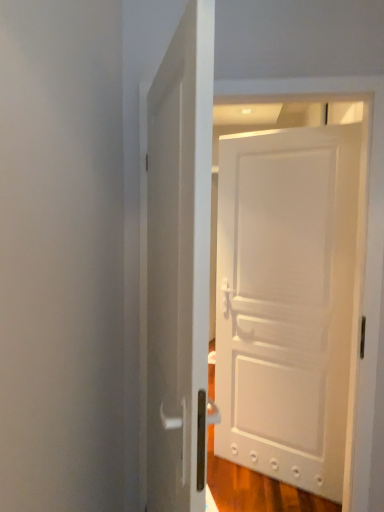
This screenshot has width=384, height=512. In order to click on vacant region under white matte door at center, which is the 2th door in left-to-right order (from a real-world perspective) in this screenshot , I will do `click(272, 478)`.